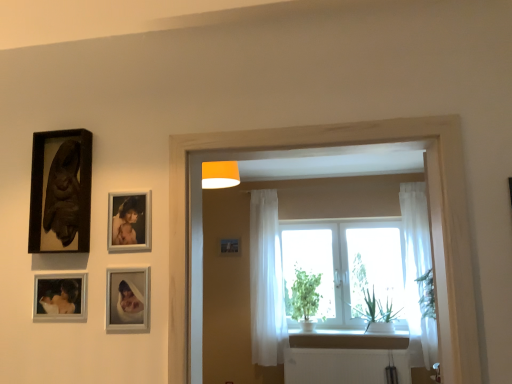
Question: From the image's perspective, relative to white plastic radiator at lower center, is white sheer curtain at right, positioned as the second curtain in left-to-right order, above or below?

Choices:
 (A) below
 (B) above

Answer: (B)

Question: Is point (408, 264) closer or farther from the camera than point (332, 372)?

Choices:
 (A) closer
 (B) farther

Answer: (B)

Question: Which is nearer to the white sheer curtain at center, placed as the 2th curtain when sorted from right to left?

Choices:
 (A) transparent glass window at center
 (B) white plastic radiator at lower center
 (C) green leafy plant at window, which is the first plant in left-to-right order
 (D) white matte window frame at center
 (E) green leafy plant at window, which is the 1th plant in right-to-left order

Answer: (C)

Question: Which object is the farthest from the white sheer curtain at right, arranged as the first curtain when viewed from the right?

Choices:
 (A) matte black picture frame at center
 (B) green leafy plant at window, the second plant positioned from the left
 (C) white sheer curtain at center, placed as the 1th curtain when sorted from left to right
 (D) transparent glass window at center
 (E) white plastic radiator at lower center

Answer: (A)